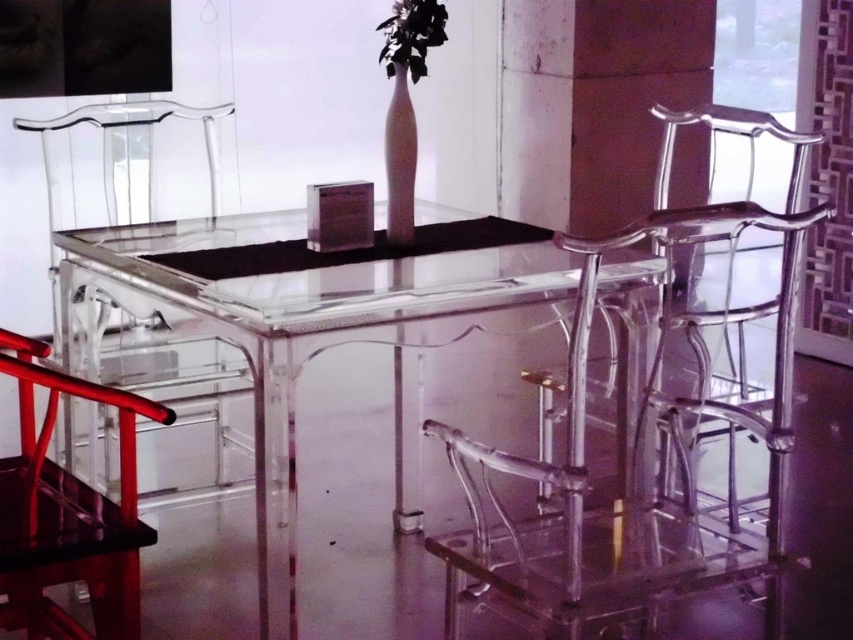
You are planning to place a decorative item on the transparent acrylic chair at lower left and the black matte flower at upper center. Which object can accommodate a larger item?

The transparent acrylic chair at lower left is bigger than the black matte flower at upper center, so it can accommodate a larger item.

You are arranging flowers for a dinner event and need to place the black matte flower at upper center on the table. Considering the space taken by the transparent acrylic chair at lower left, will the flower fit on the table without overlapping the chair?

The transparent acrylic chair at lower left is wider than the black matte flower at upper center. Since the flower is smaller in width, it should fit on the table without overlapping the chair as long as it is placed in an area not occupied by the chair.

You are a guest entering the dining area and want to sit down at the transparent acrylic table at center. Can you sit on the transparent acrylic chair at lower left without adjusting your height?

The transparent acrylic table at center is taller than the transparent acrylic chair at lower left, so you may need to adjust your height to sit comfortably.